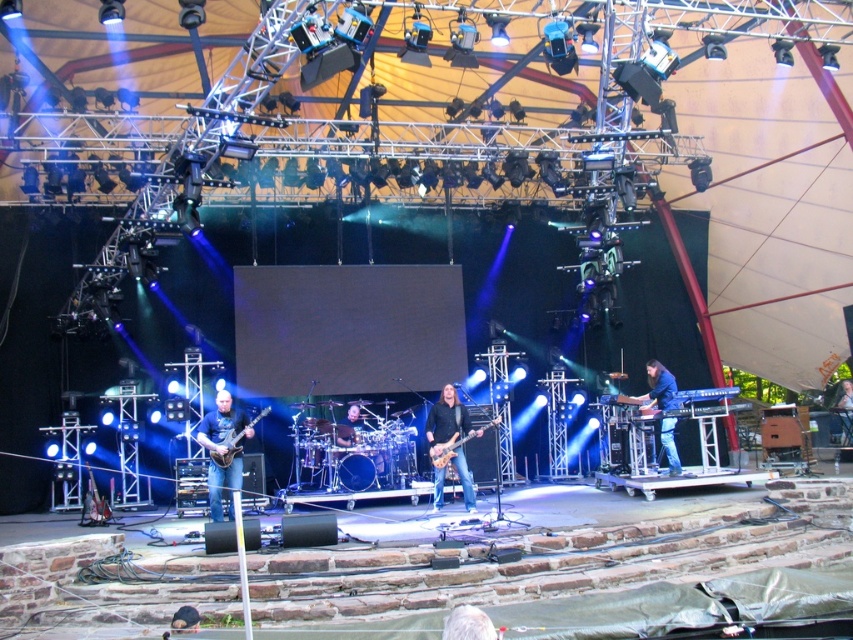
You are a photographer at the live music performance. You want to capture a closeup of the drummer at the center of the stage. The drummer is at the center of the stage, but there is an obstruction at point (468,625). Where is the obstruction located relative to the drummer?

The obstruction at point (468,625) is located at the lower center of the drummer.

You are a technician adjusting the lighting for the stage. You need to position a spotlight directly above the matte black guitar at center. According to the coordinates provided, where should you aim the spotlight?

The matte black guitar at center is located at point [222,451], so you should aim the spotlight at those coordinates to position it directly above.